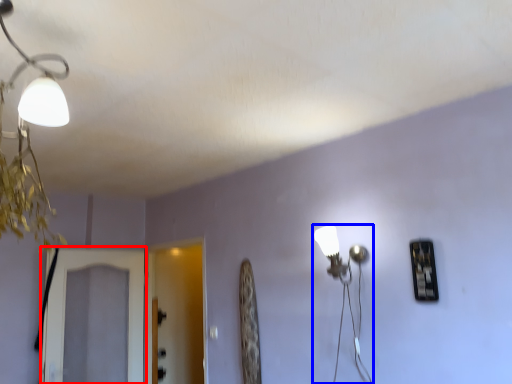
Question: Which of the following is the farthest to the observer, screen door (highlighted by a red box) or lamp (highlighted by a blue box)?

Choices:
 (A) screen door
 (B) lamp

Answer: (A)